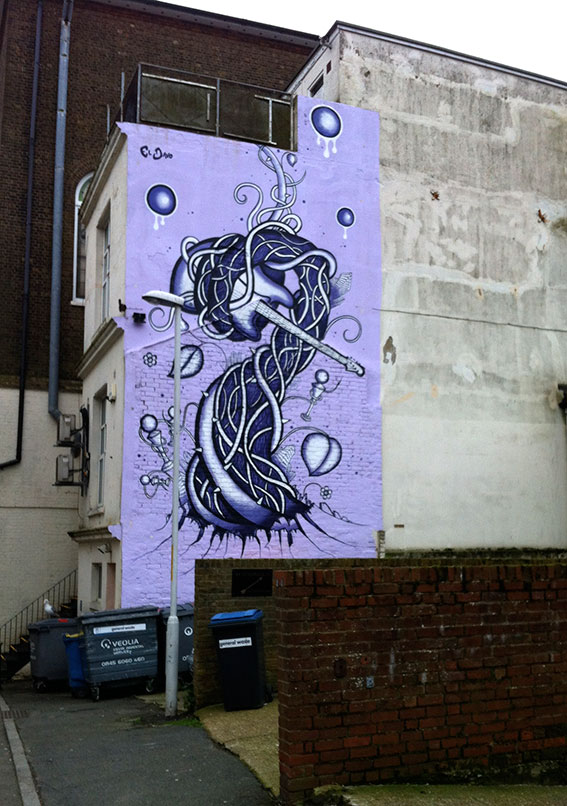
Find the location of a particular element. mural is located at coordinates (261, 350).